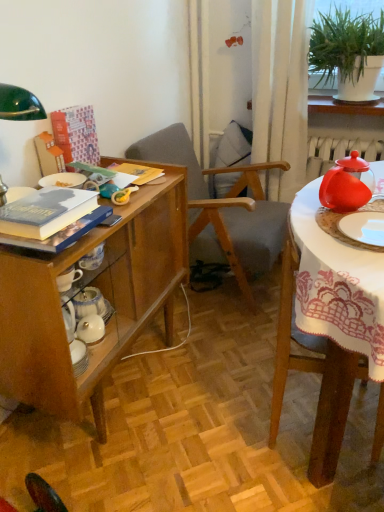
This screenshot has height=512, width=384. What are the coordinates of `vacant space situated on the left part of wooden chair at right, the 1th chair positioned from the front` in the screenshot? It's located at (203, 409).